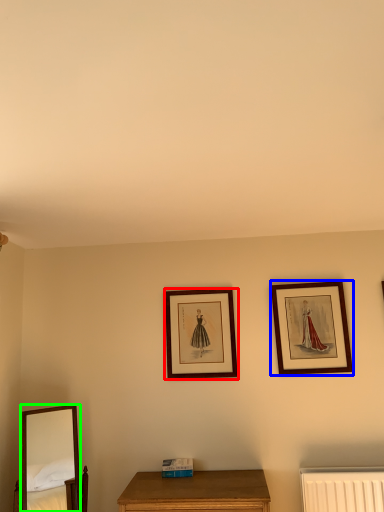
Question: Based on their relative distances, which object is farther from picture frame (highlighted by a red box)? Choose from picture frame (highlighted by a blue box) and mirror (highlighted by a green box).

Choices:
 (A) picture frame
 (B) mirror

Answer: (B)